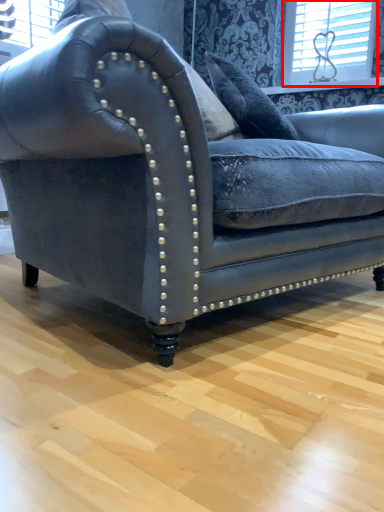
Question: Considering the relative positions of window (annotated by the red box) and studio couch in the image provided, where is window (annotated by the red box) located with respect to the staircase?

Choices:
 (A) left
 (B) right

Answer: (B)